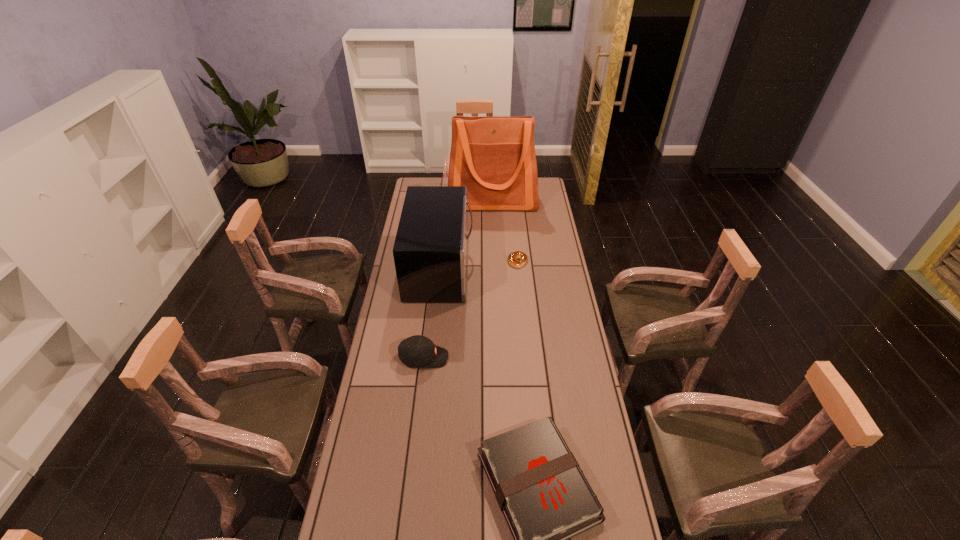
At what (x,y) coordinates should I click in order to perform the action: click on object that is the closest to the fourth shortest object. Please return your answer as a coordinate pair (x, y). Looking at the image, I should click on (512, 258).

In order to click on free space that satisfies the following two spatial constraints: 1. on the front pocket of the tallest object; 2. with the door open on the microwave oven in this screenshot , I will do click(494, 268).

Image resolution: width=960 pixels, height=540 pixels. I want to click on free space that satisfies the following two spatial constraints: 1. on the front pocket of the shopping bag; 2. with a logo on the front of the baseball cap, so click(498, 357).

Identify the location of vacant region that satisfies the following two spatial constraints: 1. on the front pocket of the shopping bag; 2. on the left side of the shortest object. (494, 261).

Identify the location of vacant space that satisfies the following two spatial constraints: 1. on the front side of the shortest object; 2. with the door open on the microwave oven. The height and width of the screenshot is (540, 960). (518, 268).

Where is `vacant space that satisfies the following two spatial constraints: 1. on the front pocket of the shopping bag; 2. with a logo on the front of the baseball cap`? This screenshot has height=540, width=960. vacant space that satisfies the following two spatial constraints: 1. on the front pocket of the shopping bag; 2. with a logo on the front of the baseball cap is located at coordinates (498, 357).

Find the location of a particular element. The image size is (960, 540). blank space that satisfies the following two spatial constraints: 1. on the front side of the bagel; 2. with a logo on the front of the baseball cap is located at coordinates (527, 357).